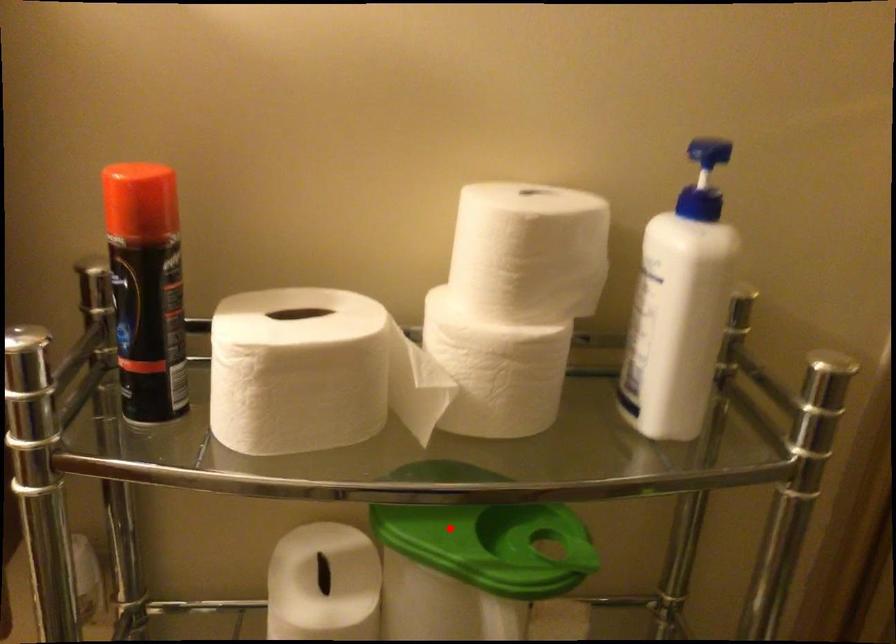
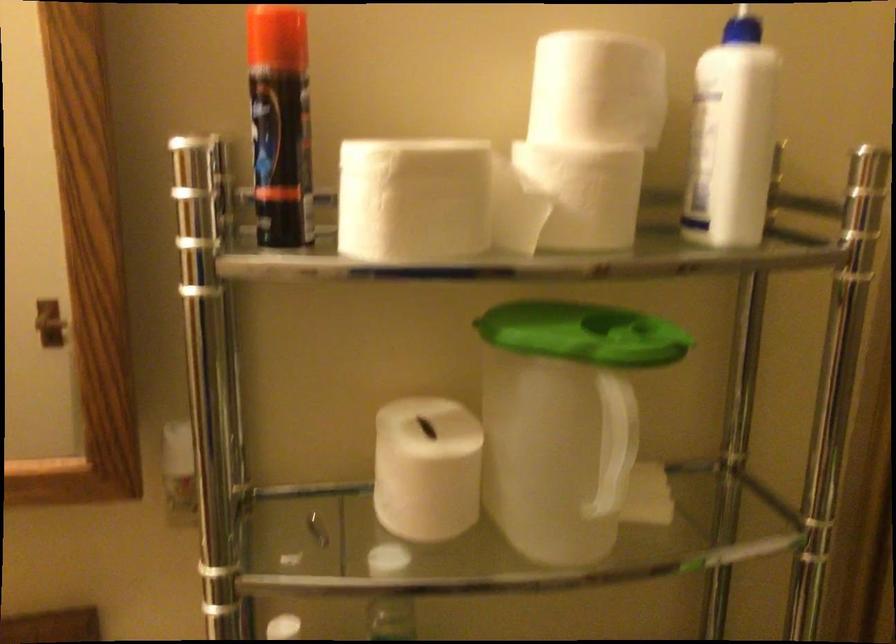
In the second image, find the point that corresponds to the highlighted location in the first image.

(563, 327)